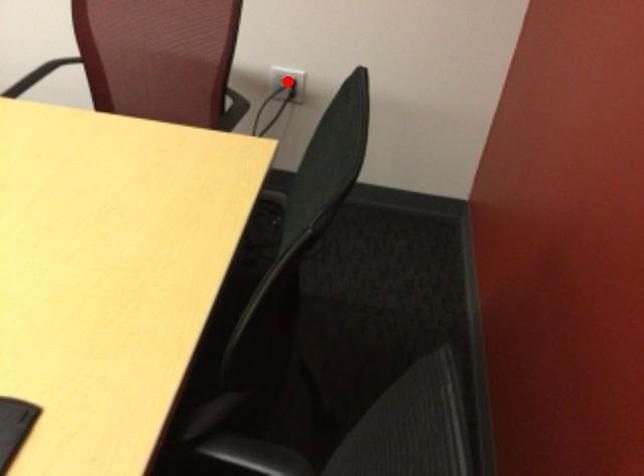
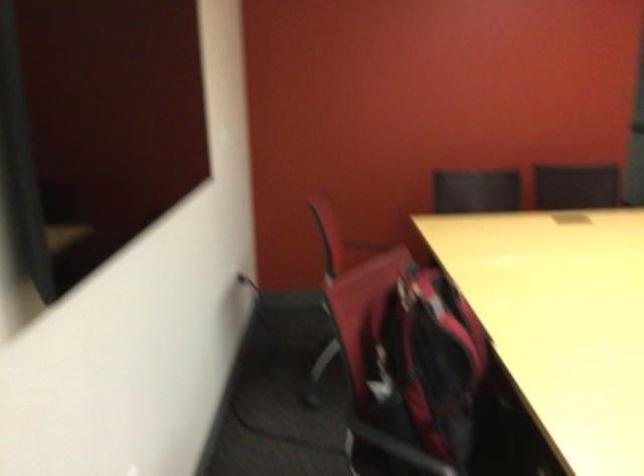
Question: I am providing you with two images of the same scene from different viewpoints. A red point is marked on the first image. Is the red point's position out of view in image 2?

Choices:
 (A) Yes
 (B) No

Answer: (A)